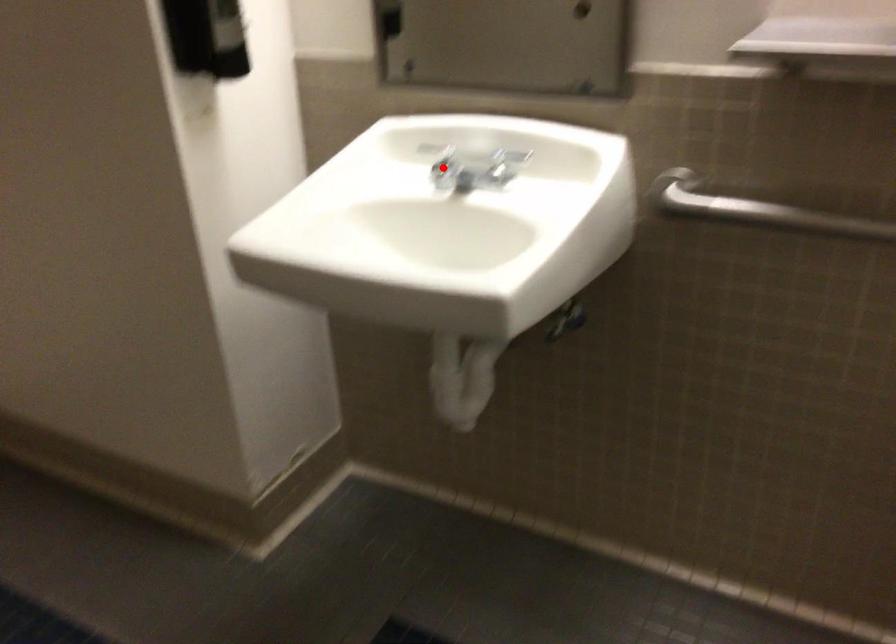
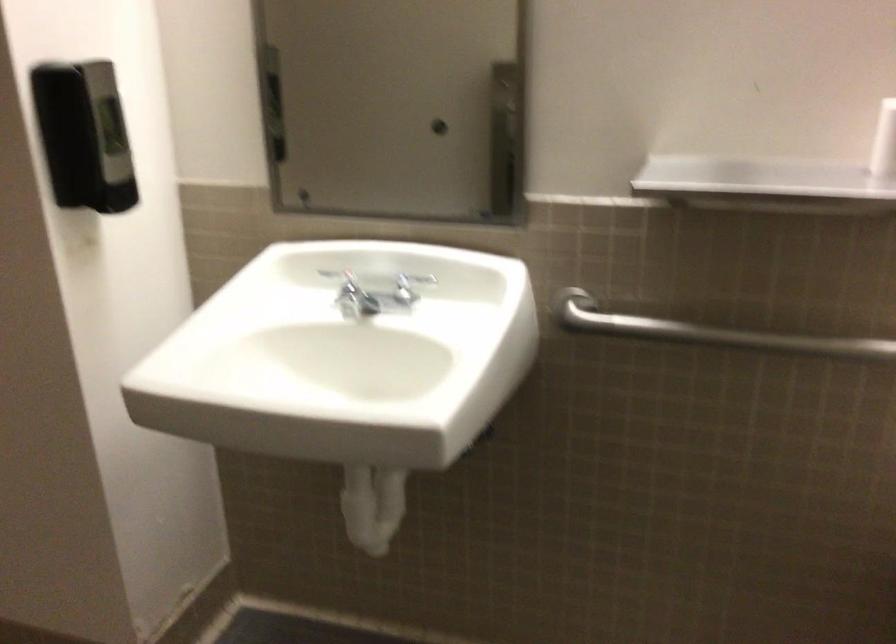
Question: I am providing you with two images of the same scene from different viewpoints. In image1, a red point is highlighted. Considering the same 3D point in image2, which of the following is correct?

Choices:
 (A) It is closer
 (B) It is farther

Answer: (B)